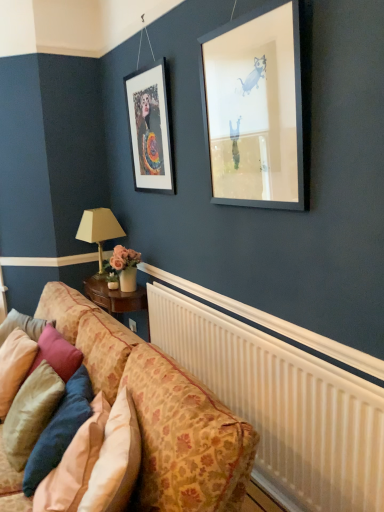
Question: Considering the positions of matte black frame at upper left and velvet beige pillow at lower left, which is counted as the first pillow, starting from the left, in the image, is matte black frame at upper left taller or shorter than velvet beige pillow at lower left, which is counted as the first pillow, starting from the left,?

Choices:
 (A) short
 (B) tall

Answer: (B)

Question: Would you say matte black frame at upper left is inside or outside velvet beige pillow at lower left, the third pillow when ordered from right to left?

Choices:
 (A) inside
 (B) outside

Answer: (B)

Question: Which of these objects is positioned closest to the velvet beige pillow at lower left, the third pillow when ordered from right to left?

Choices:
 (A) patterned fabric couch at lower left
 (B) matte black frame at upper left
 (C) white plastic radiator at lower right
 (D) velvet pink pillow at lower left, marked as the 2th pillow in a right-to-left arrangement
 (E) beige fabric lampshade at lower left

Answer: (D)

Question: Considering the real-world distances, which object is farthest from the patterned fabric couch at lower left?

Choices:
 (A) velvety blue pillow at lower left, arranged as the third pillow when viewed from the left
 (B) velvet pink pillow at lower left, marked as the 2th pillow in a right-to-left arrangement
 (C) velvet beige pillow at lower left, which is counted as the first pillow, starting from the left
 (D) matte black frame at upper left
 (E) white plastic radiator at lower right

Answer: (D)